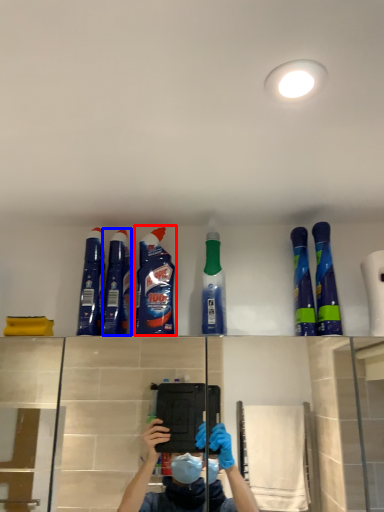
Question: Which of the following is the closest to the observer, cleaning product (highlighted by a red box) or cleaning product (highlighted by a blue box)?

Choices:
 (A) cleaning product
 (B) cleaning product

Answer: (B)